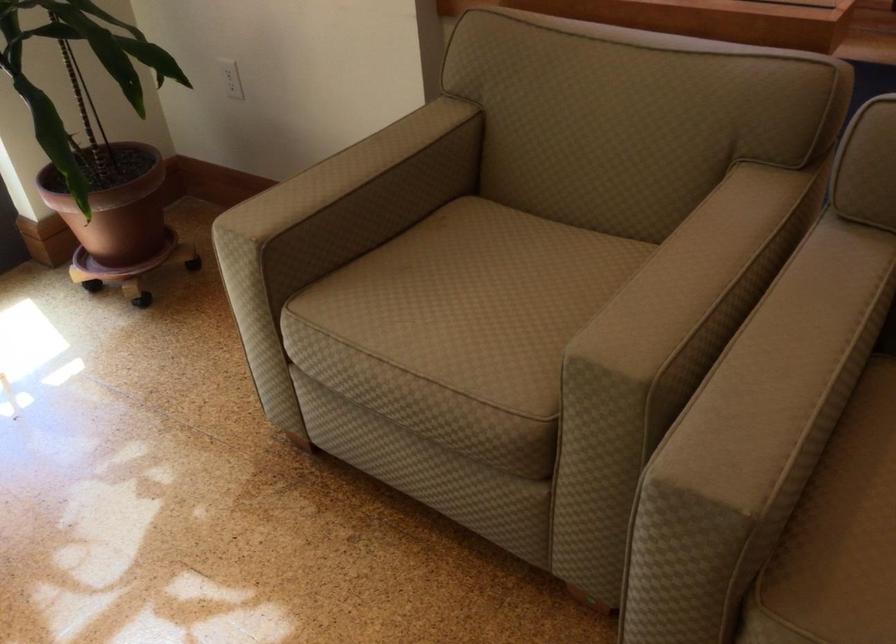
The location [116,210] corresponds to which object?

This point indicates the wheeled plant stand.